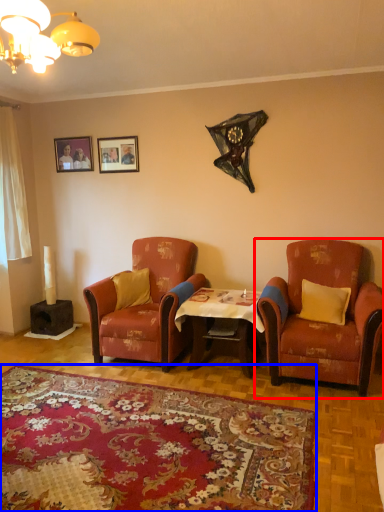
Question: Which object is further to the camera taking this photo, chair (highlighted by a red box) or plain (highlighted by a blue box)?

Choices:
 (A) chair
 (B) plain

Answer: (A)